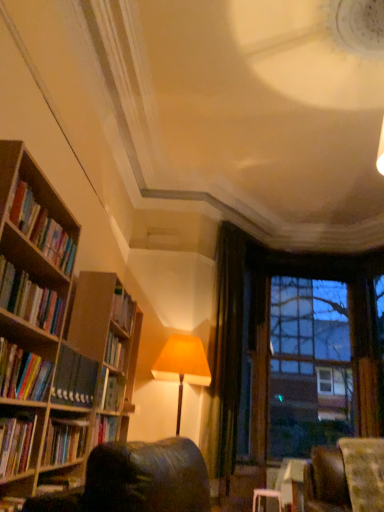
Question: Could you tell me if green velvet curtain at center is facing hardcover books at left, the fifth book when ordered from bottom to top?

Choices:
 (A) no
 (B) yes

Answer: (A)

Question: Considering the relative sizes of green velvet curtain at center and hardcover books at left, the fifth book when ordered from bottom to top, in the image provided, is green velvet curtain at center bigger than hardcover books at left, the fifth book when ordered from bottom to top,?

Choices:
 (A) no
 (B) yes

Answer: (B)

Question: Is hardcover books at left, which appears as the first book when viewed from the top, at the back of green velvet curtain at center?

Choices:
 (A) no
 (B) yes

Answer: (A)

Question: Can you see green velvet curtain at center touching hardcover books at left, which appears as the first book when viewed from the top?

Choices:
 (A) no
 (B) yes

Answer: (A)

Question: Does green velvet curtain at center come behind hardcover books at left, which appears as the first book when viewed from the top?

Choices:
 (A) no
 (B) yes

Answer: (B)

Question: From the image's perspective, is hardcover books at left, positioned as the third book in bottom-to-top order, above or below hardcover book at left, the fifth book in the top-to-bottom sequence?

Choices:
 (A) below
 (B) above

Answer: (B)

Question: Is hardcover books at left, the 3th book positioned from the top, inside the boundaries of hardcover book at left, the fifth book in the top-to-bottom sequence, or outside?

Choices:
 (A) outside
 (B) inside

Answer: (A)

Question: Is hardcover books at left, positioned as the third book in bottom-to-top order, wider or thinner than hardcover book at left, which ranks as the 1th book in bottom-to-top order?

Choices:
 (A) wide
 (B) thin

Answer: (A)

Question: From their relative heights in the image, would you say hardcover books at left, positioned as the third book in bottom-to-top order, is taller or shorter than hardcover book at left, which ranks as the 1th book in bottom-to-top order?

Choices:
 (A) tall
 (B) short

Answer: (B)

Question: Based on their sizes in the image, would you say green velvet curtain at center is bigger or smaller than hardcover books at left, which is the fourth book from top to bottom?

Choices:
 (A) small
 (B) big

Answer: (B)

Question: Is point (223, 400) closer or farther from the camera than point (56, 364)?

Choices:
 (A) farther
 (B) closer

Answer: (A)

Question: In the image, is green velvet curtain at center on the left side or the right side of hardcover books at left, the second book from the bottom?

Choices:
 (A) right
 (B) left

Answer: (A)

Question: Considering their positions, is green velvet curtain at center located in front of or behind hardcover books at left, which is the fourth book from top to bottom?

Choices:
 (A) front
 (B) behind

Answer: (B)

Question: In terms of size, does hardcover books at left, positioned as the third book in bottom-to-top order, appear bigger or smaller than brown wooden window frame at upper right?

Choices:
 (A) small
 (B) big

Answer: (A)

Question: From a real-world perspective, is hardcover books at left, the 3th book positioned from the top, above or below brown wooden window frame at upper right?

Choices:
 (A) below
 (B) above

Answer: (A)